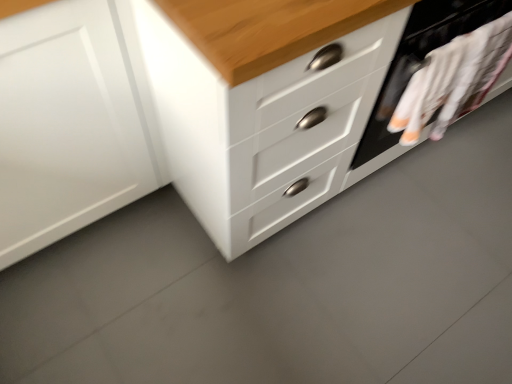
Question: Is white matte cabinet at left to the left or to the right of white fabric at right in the image?

Choices:
 (A) left
 (B) right

Answer: (A)

Question: Is white matte cabinet at left wider or thinner than white fabric at right?

Choices:
 (A) thin
 (B) wide

Answer: (B)

Question: Estimate the real-world distances between objects in this image. Which object is farther from the white glossy chest of drawers at center?

Choices:
 (A) white fabric at right
 (B) white matte cabinet at left

Answer: (A)

Question: Considering the real-world distances, which object is farthest from the white matte cabinet at left?

Choices:
 (A) white fabric at right
 (B) white glossy chest of drawers at center

Answer: (A)